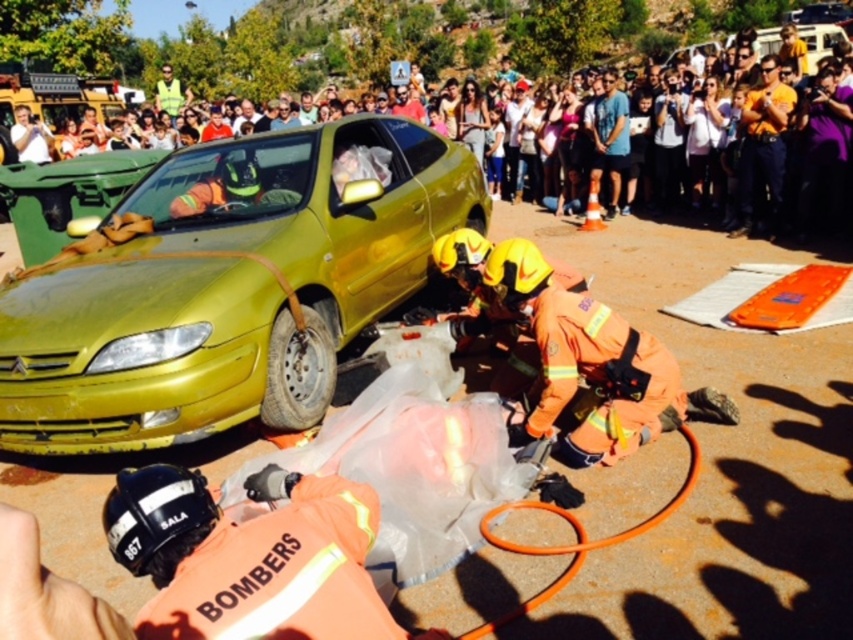
In the scene shown: Does metallic yellow car at left appear on the right side of matte yellow car at center?

Yes, metallic yellow car at left is to the right of matte yellow car at center.

Between metallic yellow car at left and matte yellow car at center, which one appears on the right side from the viewer's perspective?

metallic yellow car at left is more to the right.

Is point (360, 230) positioned behind point (238, 90)?

No, it is in front of (238, 90).

What are the coordinates of `metallic yellow car at left` in the screenshot? It's located at (227, 285).